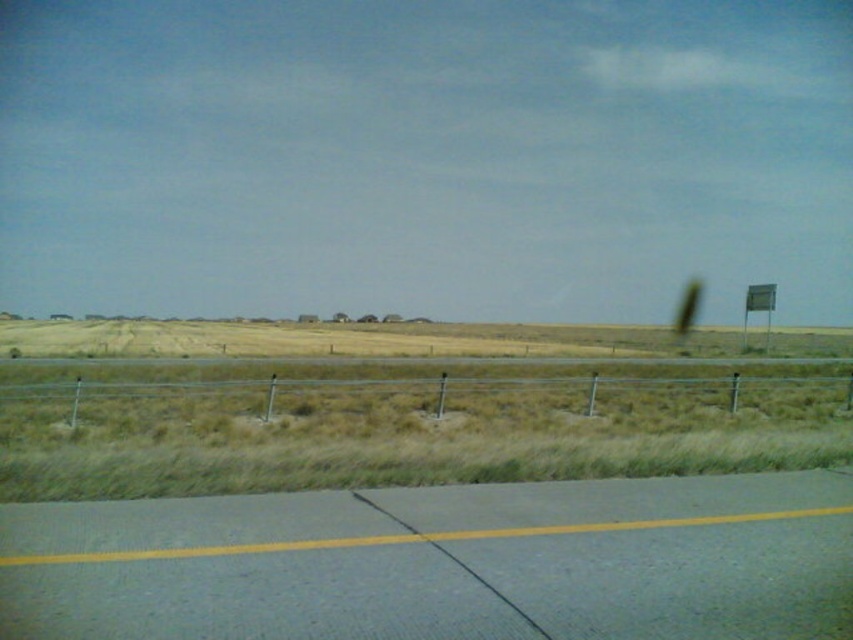
Question: Can you confirm if asphalt road at lower center is positioned to the left of metallic sign at right?

Choices:
 (A) yes
 (B) no

Answer: (A)

Question: Among these points, which one is farthest from the camera?

Choices:
 (A) (628, 371)
 (B) (502, 518)

Answer: (A)

Question: Which object is positioned closest to the metallic sign at right?

Choices:
 (A) asphalt road at lower center
 (B) metallic wire fence at center

Answer: (B)

Question: Considering the relative positions of metallic wire fence at center and metallic sign at right in the image provided, where is metallic wire fence at center located with respect to metallic sign at right?

Choices:
 (A) left
 (B) right

Answer: (A)

Question: Is asphalt road at lower center wider than metallic sign at right?

Choices:
 (A) yes
 (B) no

Answer: (B)

Question: Which object appears farthest from the camera in this image?

Choices:
 (A) metallic sign at right
 (B) metallic wire fence at center

Answer: (A)